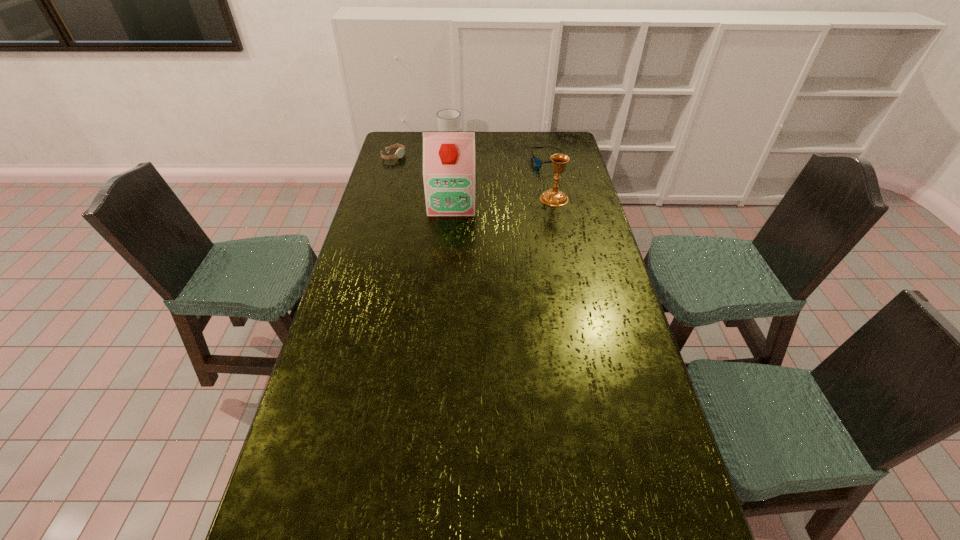
At what (x,y) coordinates should I click in order to perform the action: click on sunglasses present at the far edge. Please return your answer as a coordinate pair (x, y). Looking at the image, I should click on (538, 163).

I want to click on object present at the left edge, so click(x=400, y=152).

Identify the location of chalice situated at the right edge. (553, 197).

At what (x,y) coordinates should I click in order to perform the action: click on sunglasses located in the right edge section of the desktop. Please return your answer as a coordinate pair (x, y). Looking at the image, I should click on (538, 163).

The height and width of the screenshot is (540, 960). In order to click on object present at the far left corner in this screenshot , I will do `click(400, 152)`.

Locate an element on the screen. object that is positioned at the far right corner is located at coordinates (538, 163).

Locate an element on the screen. The height and width of the screenshot is (540, 960). free location at the far edge of the desktop is located at coordinates (516, 140).

Locate an element on the screen. Image resolution: width=960 pixels, height=540 pixels. vacant space at the near edge of the desktop is located at coordinates (526, 511).

At what (x,y) coordinates should I click in order to perform the action: click on vacant area at the left edge. Please return your answer as a coordinate pair (x, y). This screenshot has height=540, width=960. Looking at the image, I should click on (385, 187).

The image size is (960, 540). Find the location of `vacant space at the right edge of the desktop`. vacant space at the right edge of the desktop is located at coordinates (587, 294).